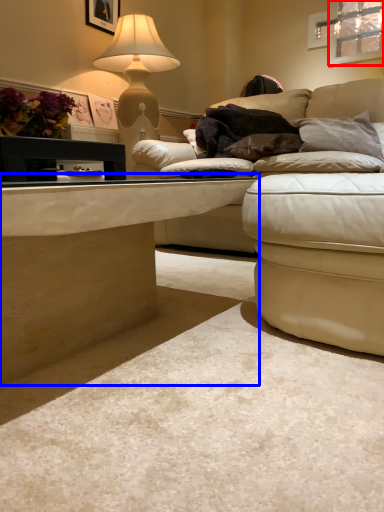
Question: Which point is further to the camera, window (highlighted by a red box) or table (highlighted by a blue box)?

Choices:
 (A) window
 (B) table

Answer: (A)